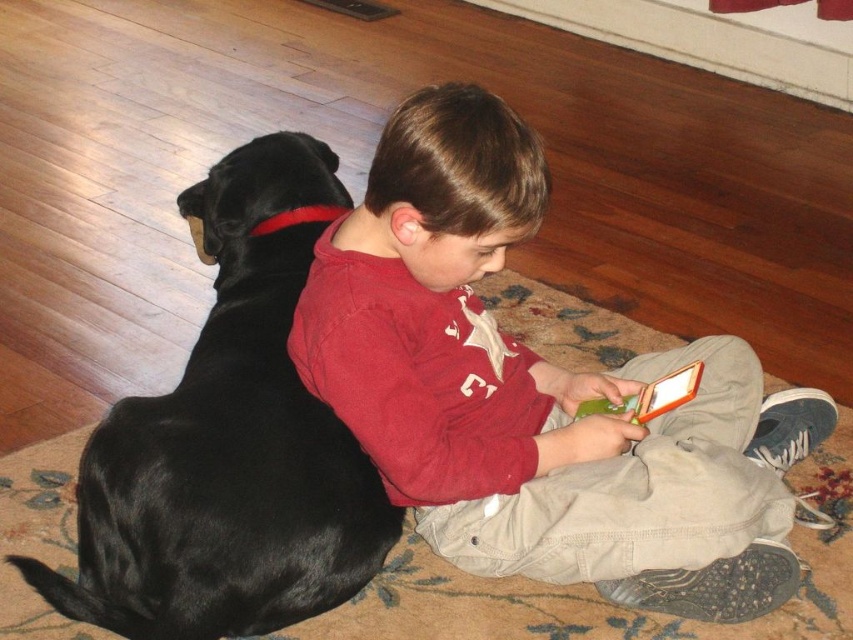
You are a photographer trying to capture the boy in the scene. If you want to focus on the matte red shirt at center, where should you aim your camera? Please provide coordinates in the format of x,y.

The matte red shirt at center is located at coordinates [535,392]. Aim your camera at that point to focus on the matte red shirt at center.